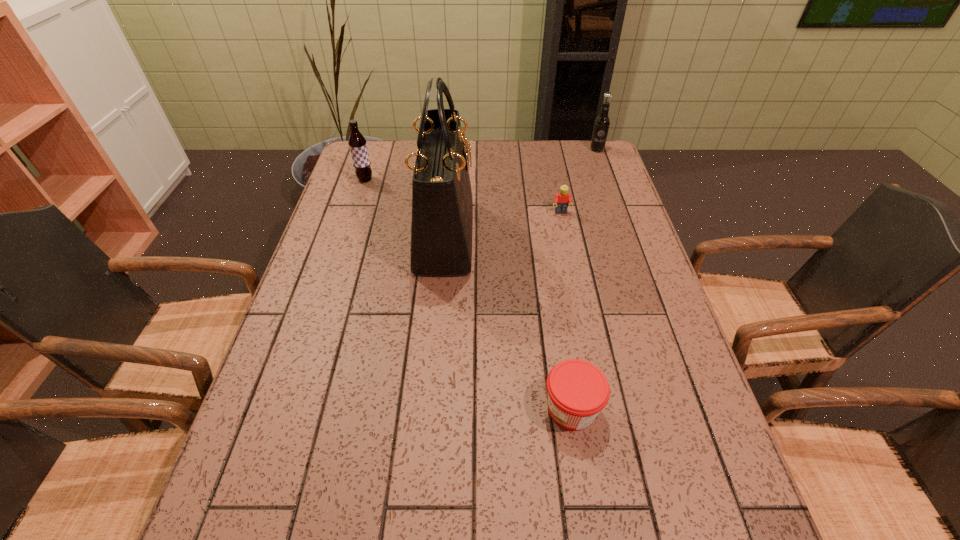
Find the location of a particular element. vacant space at the near edge of the desktop is located at coordinates 561,537.

At what (x,y) coordinates should I click in order to perform the action: click on vacant space at the left edge. Please return your answer as a coordinate pair (x, y). The height and width of the screenshot is (540, 960). Looking at the image, I should click on (234, 502).

Locate an element on the screen. The height and width of the screenshot is (540, 960). free space at the right edge is located at coordinates (598, 273).

This screenshot has height=540, width=960. I want to click on empty space between the nearer root beer and the nearest object, so (468, 294).

Locate an element on the screen. This screenshot has height=540, width=960. vacant space that is in between the jam and the farthest object is located at coordinates (584, 279).

Locate an element on the screen. Image resolution: width=960 pixels, height=540 pixels. free point between the fourth object from right to left and the rightmost object is located at coordinates (520, 192).

I want to click on unoccupied area between the nearest object and the tallest object, so click(x=508, y=322).

Locate an element on the screen. The height and width of the screenshot is (540, 960). vacant area that lies between the second farthest object and the nearest object is located at coordinates (468, 294).

The width and height of the screenshot is (960, 540). Identify the location of empty space that is in between the handbag and the Lego. (503, 224).

Locate an element on the screen. The height and width of the screenshot is (540, 960). vacant space that is in between the left root beer and the rightmost object is located at coordinates (481, 164).